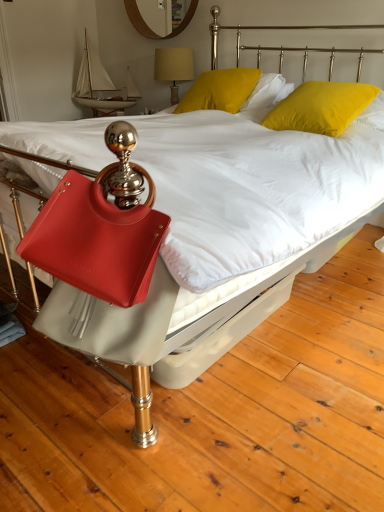
Question: Considering the relative sizes of satin red handbag at lower left and matte yellow lampshade at upper center in the image provided, is satin red handbag at lower left bigger than matte yellow lampshade at upper center?

Choices:
 (A) no
 (B) yes

Answer: (A)

Question: Does satin red handbag at lower left lie in front of matte yellow lampshade at upper center?

Choices:
 (A) no
 (B) yes

Answer: (B)

Question: Can you confirm if satin red handbag at lower left is positioned to the right of matte yellow lampshade at upper center?

Choices:
 (A) yes
 (B) no

Answer: (B)

Question: Can we say satin red handbag at lower left lies outside matte yellow lampshade at upper center?

Choices:
 (A) yes
 (B) no

Answer: (A)

Question: Does satin red handbag at lower left have a lesser width compared to matte yellow lampshade at upper center?

Choices:
 (A) yes
 (B) no

Answer: (A)

Question: Are satin red handbag at lower left and matte yellow lampshade at upper center located far from each other?

Choices:
 (A) no
 (B) yes

Answer: (B)

Question: Is the surface of matte yellow lampshade at upper center in direct contact with wooden mirror at upper center?

Choices:
 (A) no
 (B) yes

Answer: (A)

Question: From the image's perspective, is matte yellow lampshade at upper center beneath wooden mirror at upper center?

Choices:
 (A) no
 (B) yes

Answer: (B)

Question: Does matte yellow lampshade at upper center turn towards wooden mirror at upper center?

Choices:
 (A) no
 (B) yes

Answer: (A)

Question: Can you confirm if matte yellow lampshade at upper center is taller than wooden mirror at upper center?

Choices:
 (A) yes
 (B) no

Answer: (A)

Question: Does matte yellow lampshade at upper center have a lesser width compared to wooden mirror at upper center?

Choices:
 (A) yes
 (B) no

Answer: (B)

Question: Is matte yellow lampshade at upper center looking in the opposite direction of wooden mirror at upper center?

Choices:
 (A) yes
 (B) no

Answer: (B)

Question: From a real-world perspective, is matte yellow lampshade at upper center positioned over yellow velvet pillow at upper right, placed as the 2th pillow when sorted from left to right, based on gravity?

Choices:
 (A) yes
 (B) no

Answer: (A)